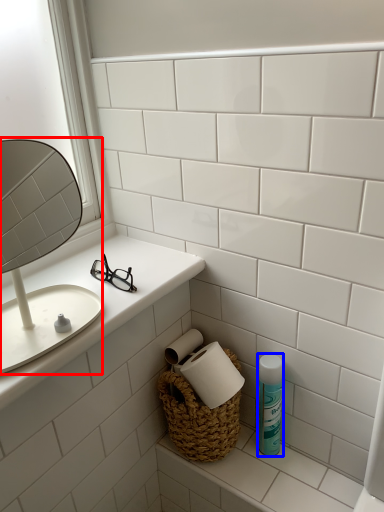
Question: Among these objects, which one is farthest to the camera, mirror (highlighted by a red box) or mouthwash (highlighted by a blue box)?

Choices:
 (A) mirror
 (B) mouthwash

Answer: (B)